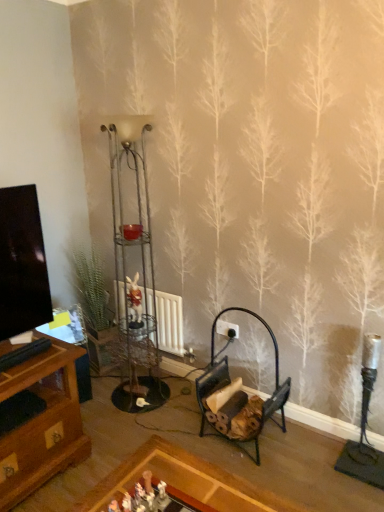
I want to click on vacant area that is situated to the right of black metal firewood rack at lower center, so click(309, 449).